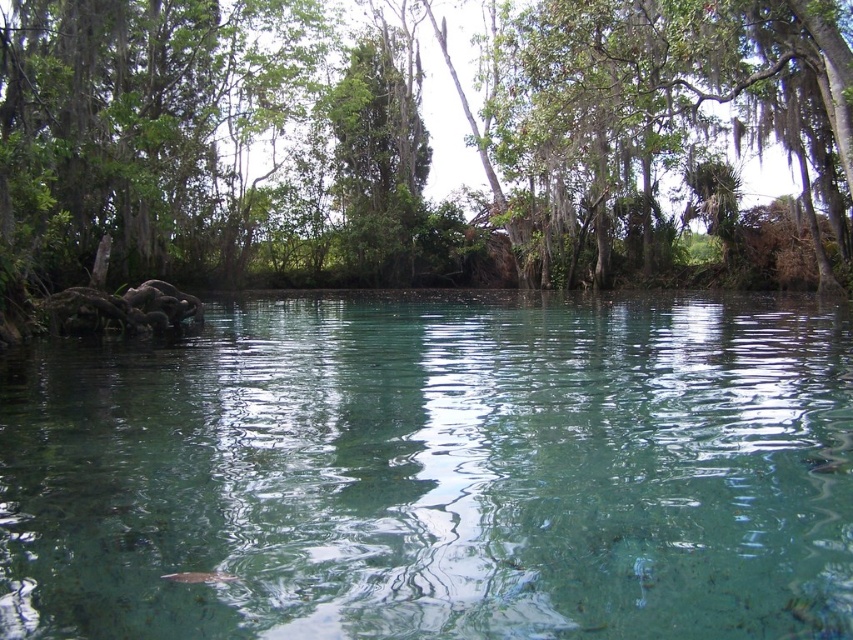
Does clear water at center have a lesser height compared to green leafy tree at center?

Yes, clear water at center is shorter than green leafy tree at center.

Which is more to the left, clear water at center or green leafy tree at center?

Positioned to the left is green leafy tree at center.

Find the location of a particular element. The width and height of the screenshot is (853, 640). clear water at center is located at coordinates (436, 472).